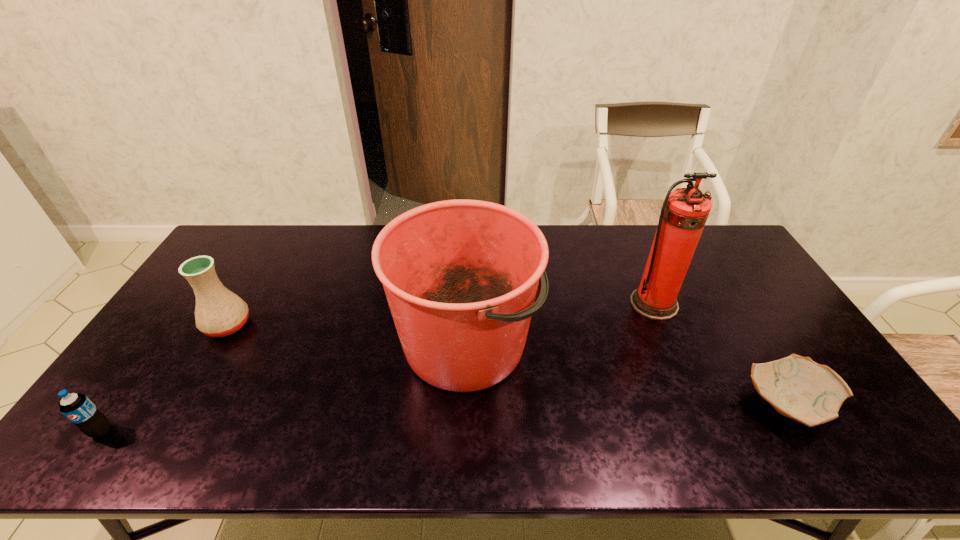
What are the coordinates of `unoccupied area between the second shortest object and the taller pottery` in the screenshot? It's located at (164, 378).

Identify the location of unoccupied position between the third object from left to right and the fourth object from right to left. (347, 333).

The width and height of the screenshot is (960, 540). What are the coordinates of `vacant space in between the tallest object and the nearer pottery` in the screenshot? It's located at (720, 354).

In order to click on free space between the third object from right to left and the fire extinguisher in this screenshot , I will do `click(560, 323)`.

This screenshot has height=540, width=960. What are the coordinates of `vacant area that lies between the rightmost object and the fourth shortest object` in the screenshot? It's located at (626, 374).

Where is `the closest object to the nearer pottery`? Image resolution: width=960 pixels, height=540 pixels. the closest object to the nearer pottery is located at coordinates pos(684,213).

You are a GUI agent. You are given a task and a screenshot of the screen. Output one action in this format:
    pyautogui.click(x=<x>, y=<y>)
    Task: Click on the object that can be found as the fourth closest to the tallest object
    The width and height of the screenshot is (960, 540).
    Given the screenshot: What is the action you would take?
    pyautogui.click(x=78, y=408)

Find the location of `free space in the image that satisfies the following two spatial constraints: 1. on the front side of the rightmost object; 2. on the right side of the second object from left to right`. free space in the image that satisfies the following two spatial constraints: 1. on the front side of the rightmost object; 2. on the right side of the second object from left to right is located at coordinates (180, 406).